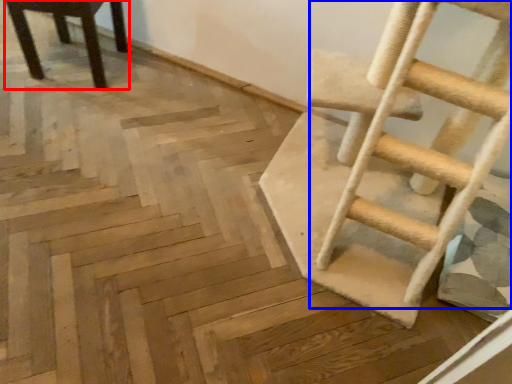
Question: Which object is closer to the camera taking this photo, chair (highlighted by a red box) or ladder (highlighted by a blue box)?

Choices:
 (A) chair
 (B) ladder

Answer: (B)